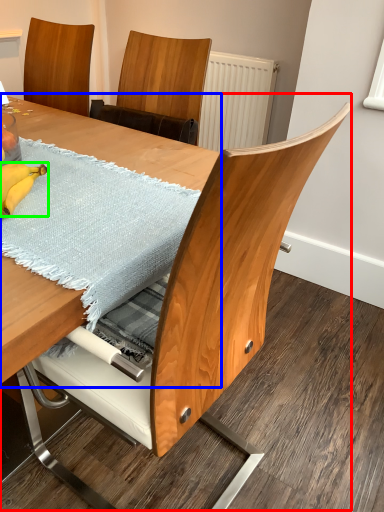
Question: Which is nearer to the table (highlighted by a red box)? table (highlighted by a blue box) or banana (highlighted by a green box).

Choices:
 (A) table
 (B) banana

Answer: (B)